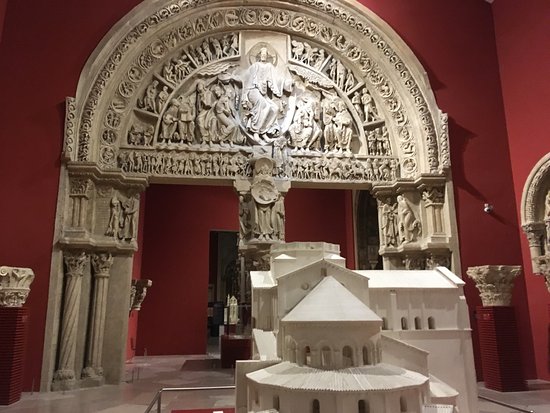
The image size is (550, 413). What are the coordinates of `open doorways` in the screenshot? It's located at (220, 265), (373, 225).